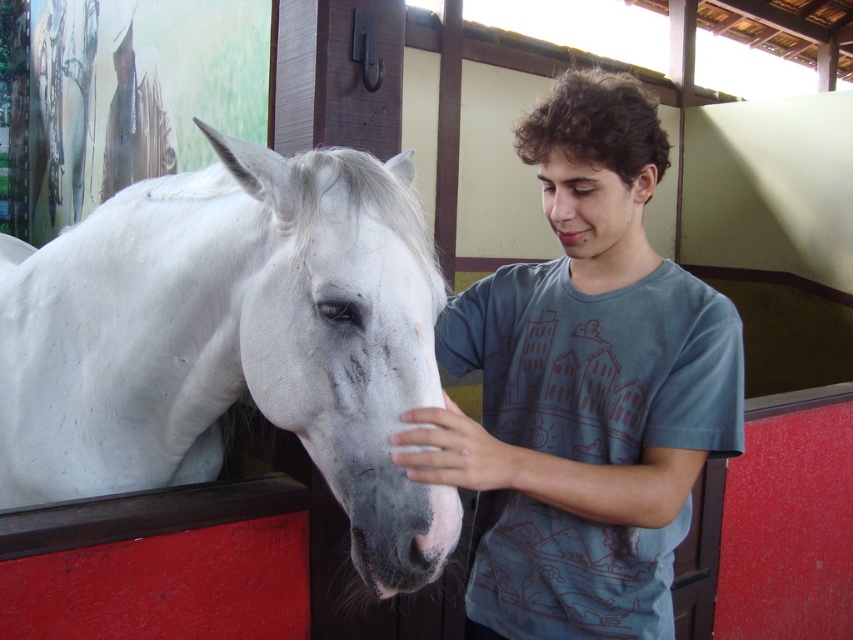
Question: Among these points, which one is farthest from the camera?

Choices:
 (A) (390, 264)
 (B) (651, 403)
 (C) (572, 227)

Answer: (C)

Question: Which object is positioned farthest from the white matte horse at left?

Choices:
 (A) matte blue shirt at center
 (B) matte skin nose at center

Answer: (B)

Question: Is white matte horse at left below matte skin nose at center?

Choices:
 (A) yes
 (B) no

Answer: (A)

Question: Can you confirm if white matte horse at left is positioned to the right of matte skin nose at center?

Choices:
 (A) no
 (B) yes

Answer: (A)

Question: Which is farther from the white matte horse at left?

Choices:
 (A) matte blue shirt at center
 (B) matte skin nose at center

Answer: (B)

Question: Can you confirm if white matte horse at left is positioned to the right of matte skin nose at center?

Choices:
 (A) yes
 (B) no

Answer: (B)